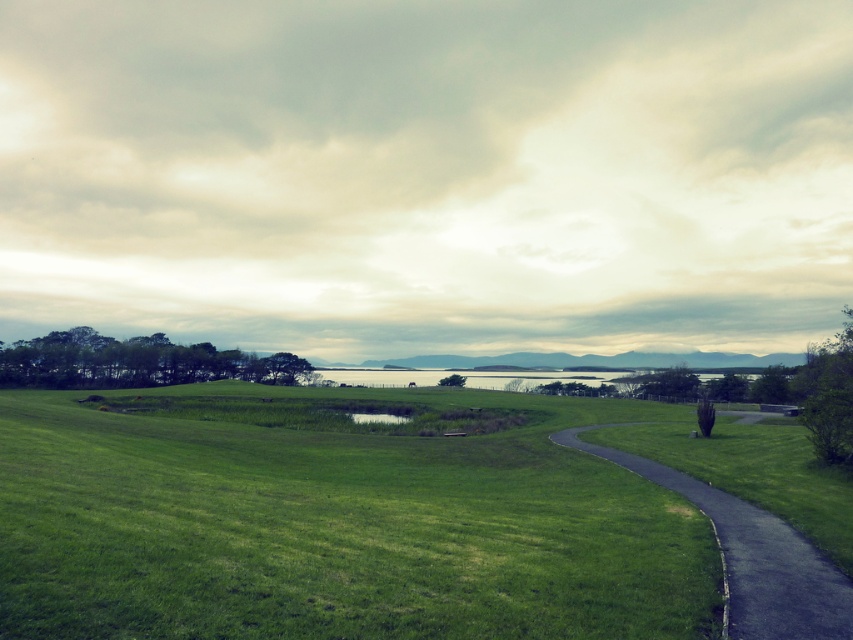
This screenshot has width=853, height=640. What do you see at coordinates (373, 515) in the screenshot?
I see `green grassy field at center` at bounding box center [373, 515].

Which is in front, point (764, 442) or point (582, 428)?

Point (764, 442) is more forward.

Which is in front, point (612, 472) or point (757, 508)?

Point (757, 508)

Image resolution: width=853 pixels, height=640 pixels. In order to click on green grassy field at center in this screenshot , I will do click(373, 515).